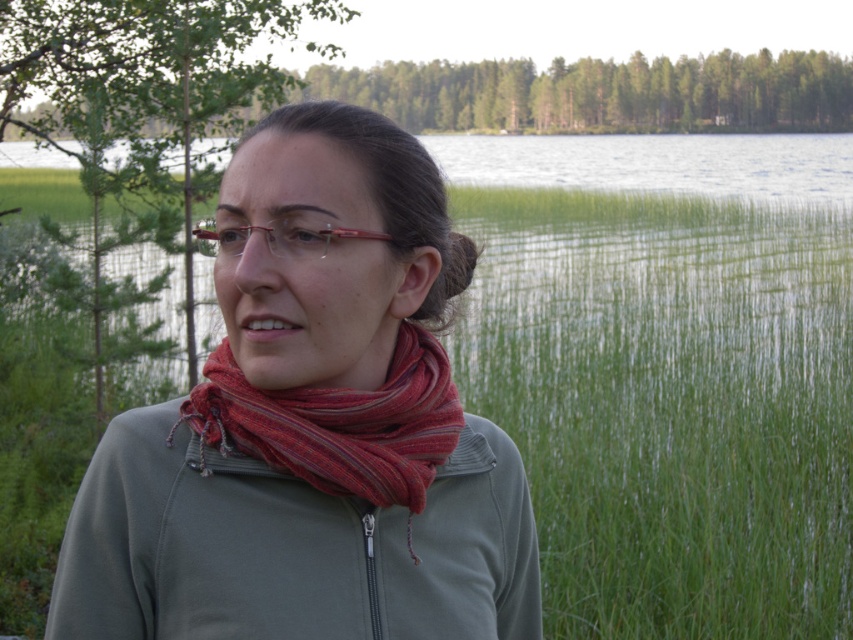
Question: Can you confirm if matte green jacket at center is wider than matte red glasses at center?

Choices:
 (A) no
 (B) yes

Answer: (A)

Question: Which of the following is the farthest from the observer?

Choices:
 (A) green leafy trees at upper center
 (B) green fleece sweatshirt at center
 (C) green leafy tree at center
 (D) striped wool scarf at center

Answer: (A)

Question: Which is farther from the matte red glasses at center?

Choices:
 (A) striped wool scarf at center
 (B) green leafy tree at center

Answer: (B)

Question: Can you confirm if matte green jacket at center is positioned above green leafy tree at center?

Choices:
 (A) no
 (B) yes

Answer: (A)

Question: Does striped wool scarf at center come behind matte red glasses at center?

Choices:
 (A) yes
 (B) no

Answer: (A)

Question: Which object appears closest to the camera in this image?

Choices:
 (A) green leafy trees at upper center
 (B) green fleece sweatshirt at center
 (C) striped wool scarf at center
 (D) matte green jacket at center

Answer: (D)